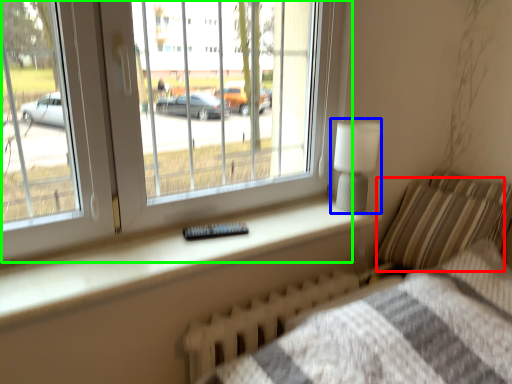
Question: Considering the real-world distances, which object is closest to pillow (highlighted by a red box)? table lamp (highlighted by a blue box) or window (highlighted by a green box).

Choices:
 (A) table lamp
 (B) window

Answer: (A)